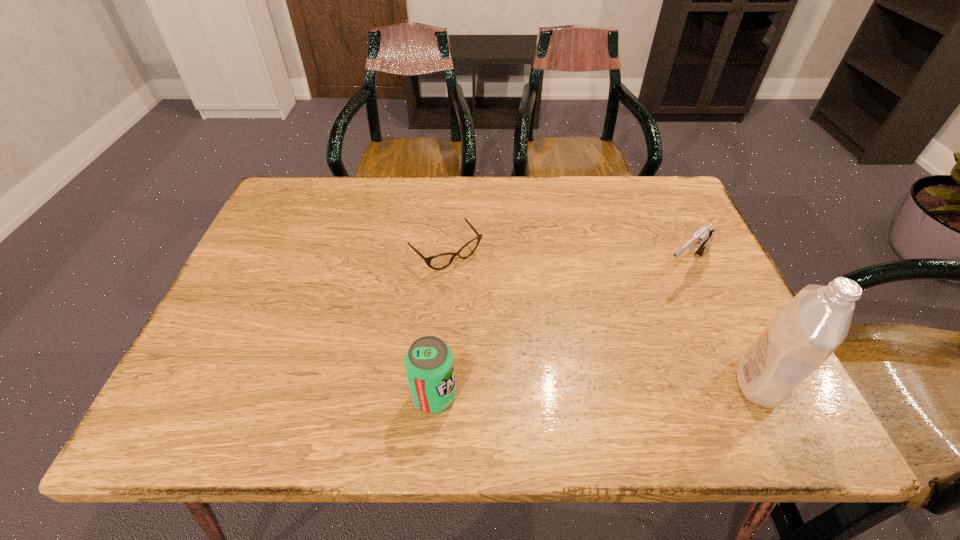
In the image, there is a desktop. Find the location of `vacant area at the near left corner`. vacant area at the near left corner is located at coordinates (254, 359).

This screenshot has height=540, width=960. In the image, there is a desktop. Identify the location of free region at the far right corner. point(682,224).

Locate an element on the screen. The height and width of the screenshot is (540, 960). unoccupied area between the spectacles and the tallest object is located at coordinates (603, 317).

Locate an element on the screen. The image size is (960, 540). free space between the detergent and the third tallest object is located at coordinates (723, 323).

Find the location of a particular element. This screenshot has height=540, width=960. free space between the spectacles and the tallest object is located at coordinates (603, 317).

I want to click on vacant area between the gun and the second tallest object, so click(x=560, y=331).

The width and height of the screenshot is (960, 540). What are the coordinates of `unoccupied area between the detergent and the gun` in the screenshot? It's located at (723, 323).

Find the location of a particular element. This screenshot has width=960, height=540. free point between the spectacles and the second shortest object is located at coordinates (565, 260).

Where is `empty space between the detergent and the third tallest object`? empty space between the detergent and the third tallest object is located at coordinates (723, 323).

Image resolution: width=960 pixels, height=540 pixels. In order to click on free space between the second tallest object and the third tallest object in this screenshot , I will do `click(560, 331)`.